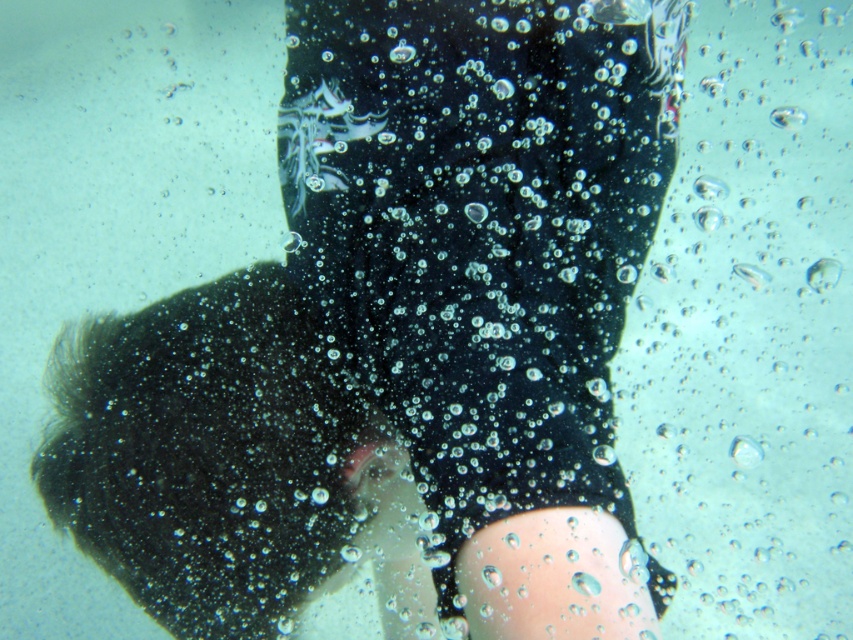
You are a swimmer trying to navigate through the bubbles in the water. You notice two areas of transparent bubbly water at center and transparent bubbly water at upper center. Which area has smaller bubbles?

The transparent bubbly water at center has smaller bubbles compared to the transparent bubbly water at upper center.

You are a lifeguard assessing the visibility of a swimmer in the pool. You notice the black matte wetsuit at center and the transparent bubbly water at center. Which object is positioned higher in the image?

The black matte wetsuit at center is taller than the transparent bubbly water at center, so the black matte wetsuit at center is positioned higher in the image.

You are a lifeguard observing the scene. You notice the black matte wetsuit at center and the transparent bubbly water at center. Which object is positioned higher in the image?

The black matte wetsuit at center is located above the transparent bubbly water at center, so it is positioned higher in the image.